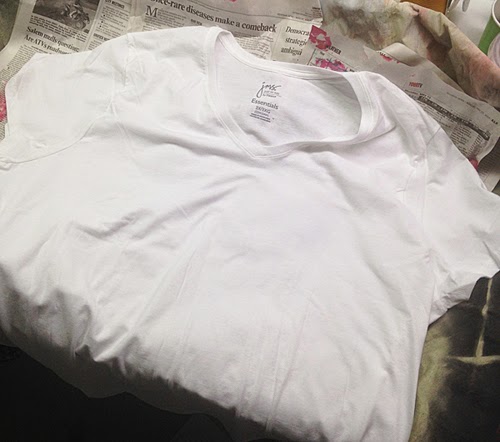
Identify the location of newspaper. (262, 9).